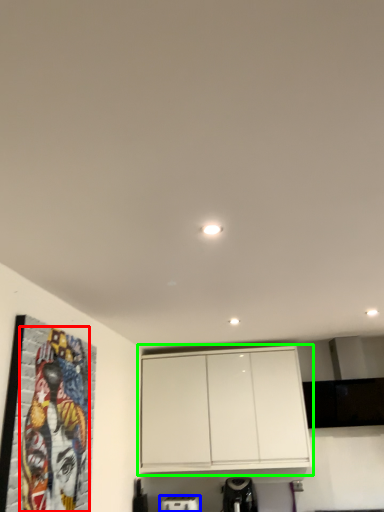
Question: Based on their relative distances, which object is farther from mural (highlighted by a red box)? Choose from appliance (highlighted by a blue box) and cabinetry (highlighted by a green box).

Choices:
 (A) appliance
 (B) cabinetry

Answer: (A)